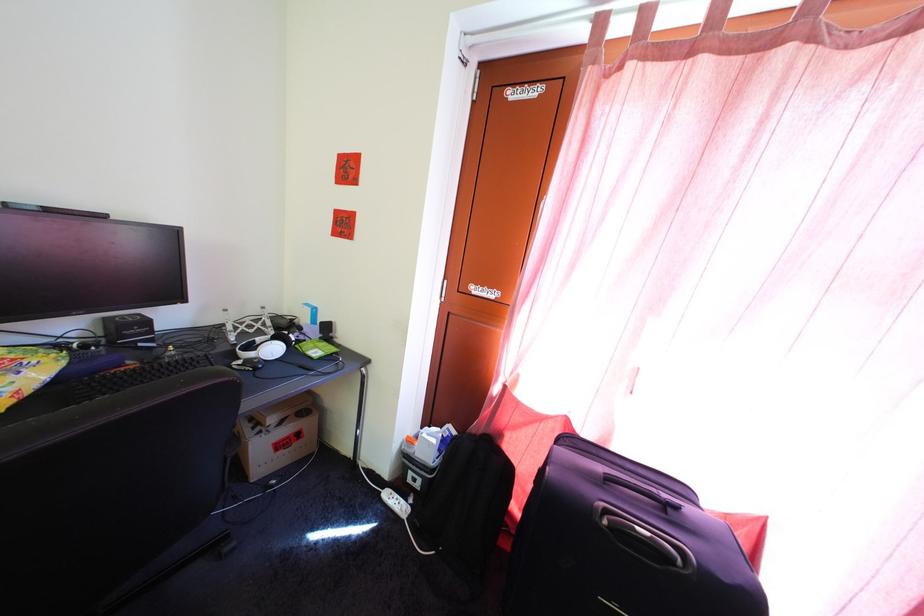
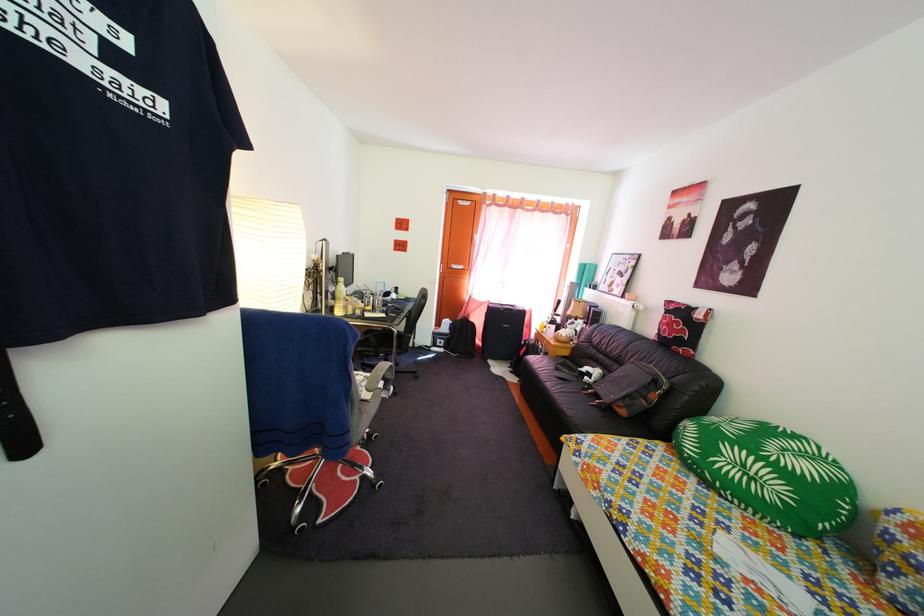
Which direction would the cameraman need to move to produce the second image?

The cameraman moved toward left, backward.